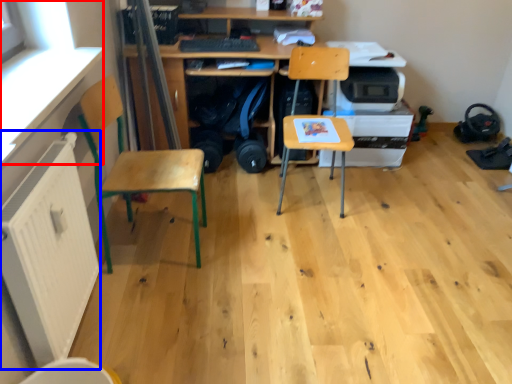
Question: Which of the following is the closest to the observer, window screen (highlighted by a red box) or radiator (highlighted by a blue box)?

Choices:
 (A) window screen
 (B) radiator

Answer: (A)